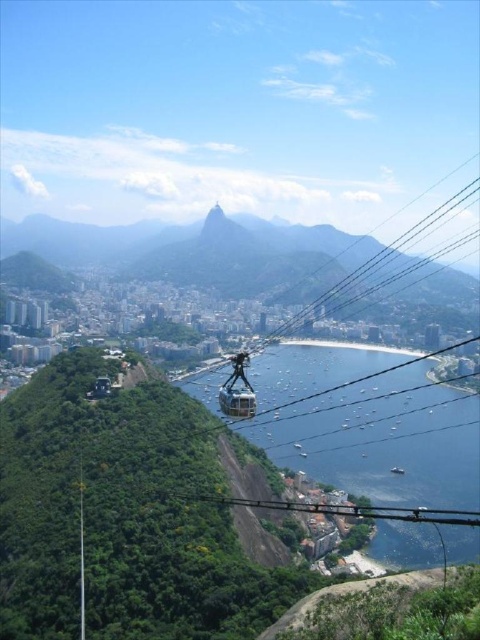
You are a drone operator planning to fly a drone from the point at coordinates point at (386, 268) to the cable car station on the hill. The drone has a maximum range of 2000 feet. Will the drone be able to reach the station?

The distance between the point at (386, 268) and the cable car station on the hill is 2206.73 feet, which exceeds the drone operator maximum range of 2000 feet. The drone will not be able to reach the station.

You are a drone operator trying to capture a photo of the green grassy mountain at center. You are currently positioned at point 0.4, 0.4. Is the mountain directly in your line of sight? Please answer based on coordinates provided.

The green grassy mountain at center is located at coordinates (201, 252), which is very close to your current position at (192, 256). Since the coordinates are nearly the same, the mountain is directly in your line of sight.

You are a tourist standing at the base of the green grassy mountain at center. You want to take a photo of the mountain with the cable cars in the background. Can you see the cable cars from your current position?

The distance of green grassy mountain at center from viewer is 616.64 meters. Since the cable cars are part of the foreground and the mountain is in the center, the cable cars would be closer to you than the mountain. Therefore, you can see the cable cars in the background behind the mountain in your photo.